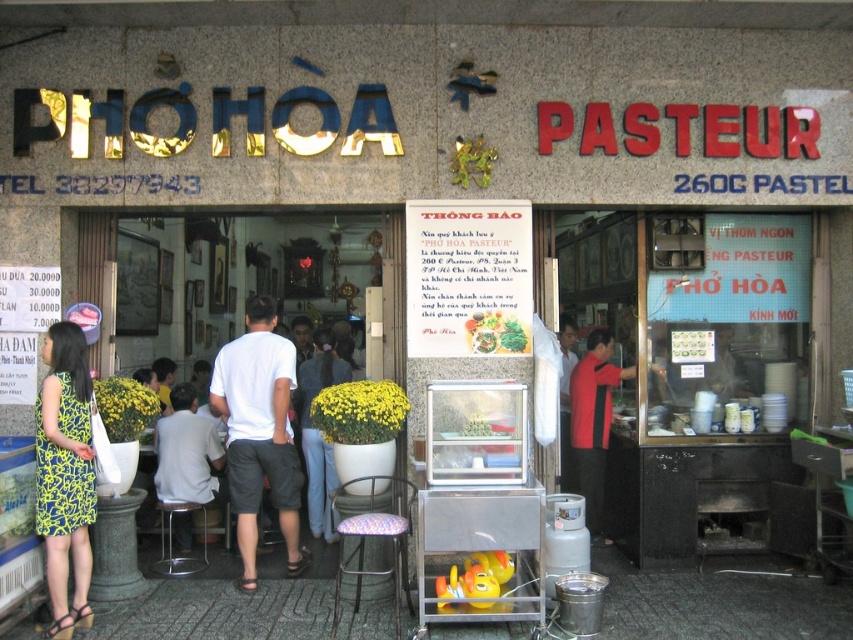
Does white cotton shirt at center have a lesser height compared to floral fabric stool at center?

In fact, white cotton shirt at center may be taller than floral fabric stool at center.

Who is lower down, white cotton shirt at center or floral fabric stool at center?

Positioned lower is floral fabric stool at center.

The height and width of the screenshot is (640, 853). Describe the element at coordinates (259, 432) in the screenshot. I see `white cotton shirt at center` at that location.

You are a GUI agent. You are given a task and a screenshot of the screen. Output one action in this format:
    pyautogui.click(x=<x>, y=<y>)
    Task: Click on the white cotton shirt at center
    
    Given the screenshot: What is the action you would take?
    pyautogui.click(x=259, y=432)

Who is lower down, blue jeans at center or green leafy vegetables at center?

Positioned lower is blue jeans at center.

Does blue jeans at center appear under green leafy vegetables at center?

Yes, blue jeans at center is below green leafy vegetables at center.

Identify the location of blue jeans at center. This screenshot has height=640, width=853. (318, 432).

Does yellow-green printed dress at lower left have a greater width compared to metallic stool at lower center?

No, yellow-green printed dress at lower left is not wider than metallic stool at lower center.

Locate an element on the screen. yellow-green printed dress at lower left is located at coordinates (65, 472).

Identify the location of yellow-green printed dress at lower left. (65, 472).